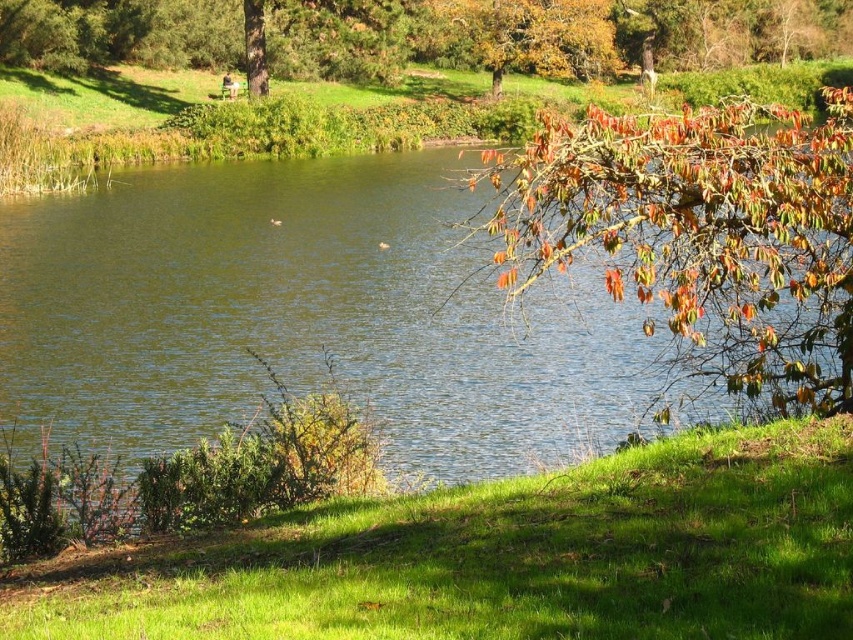
You are a gardener who wants to plant a new flower bed. You have two options for locations in the scene described. The first option is near the green grassy at lower left, and the second is near the autumn leaves at upper right. Considering the height of the existing plants, which location might be better for shorter flowers that need less sunlight?

The green grassy at lower left has a lesser height compared to autumn leaves at upper right, so planting shorter flowers there would be better to avoid overshadowing and ensure adequate sunlight.

You are planning to set up a picnic area in the scene. Considering the space available, which area would be more suitable for placing a large picnic blanket, the green grassy at lower left or the autumn leaves at upper right?

The autumn leaves at upper right would be more suitable for placing a large picnic blanket because it occupies more space than the green grassy at lower left.